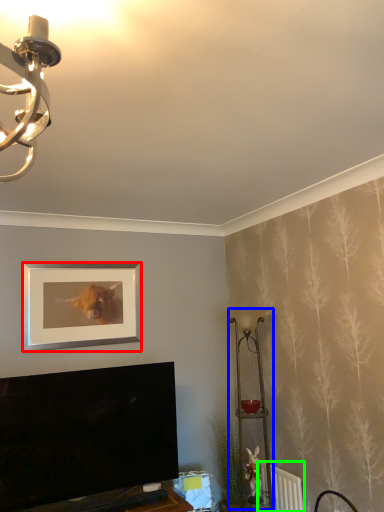
Question: Which object is positioned closest to picture frame (highlighted by a red box)? Select from table lamp (highlighted by a blue box) and radiator (highlighted by a green box).

Choices:
 (A) table lamp
 (B) radiator

Answer: (A)